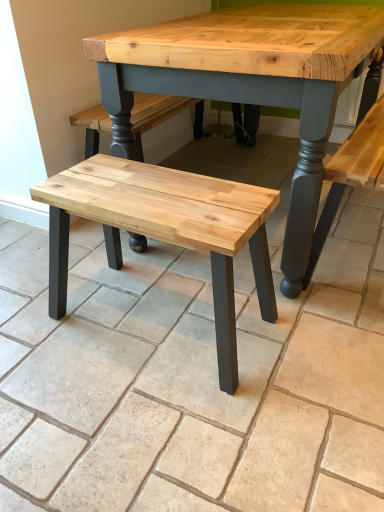
The height and width of the screenshot is (512, 384). I want to click on vacant region to the right of natural wood stool at center, so pos(317,334).